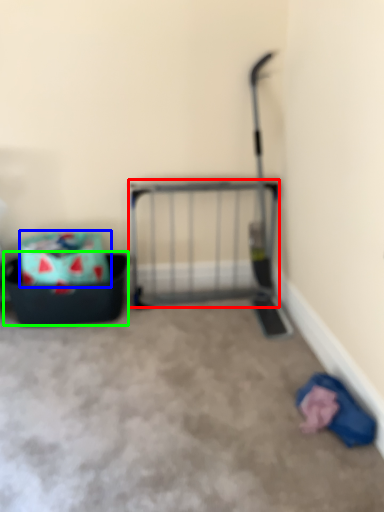
Question: Which object is the closest to the cage (highlighted by a red box)? Choose among these: storage box (highlighted by a blue box) or storage box (highlighted by a green box).

Choices:
 (A) storage box
 (B) storage box

Answer: (B)